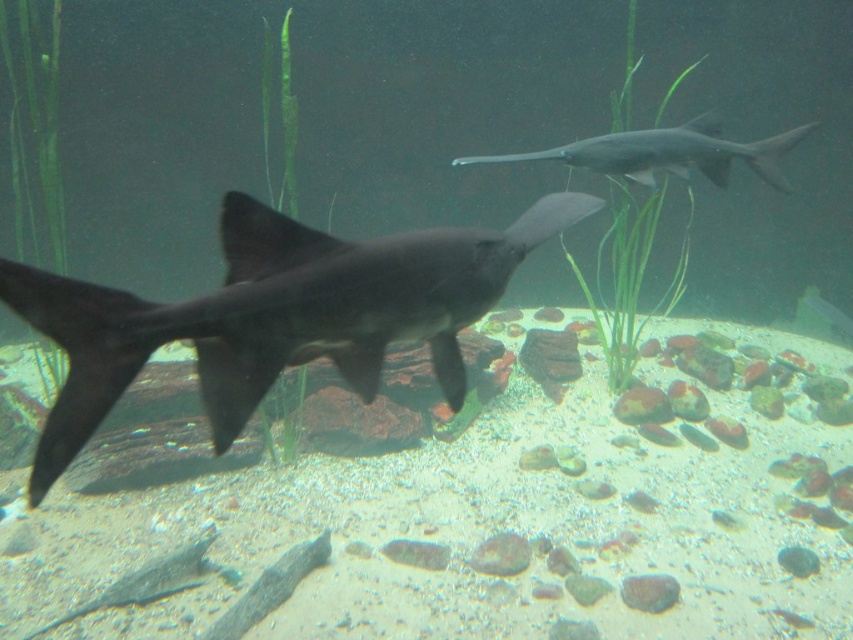
In the scene shown: Which of these two, matte black shark at center or smooth gray shark at upper center, stands taller?

Standing taller between the two is matte black shark at center.

Is matte black shark at center to the right of smooth gray shark at upper center from the viewer's perspective?

In fact, matte black shark at center is to the left of smooth gray shark at upper center.

Where is `matte black shark at center`? The width and height of the screenshot is (853, 640). matte black shark at center is located at coordinates (276, 314).